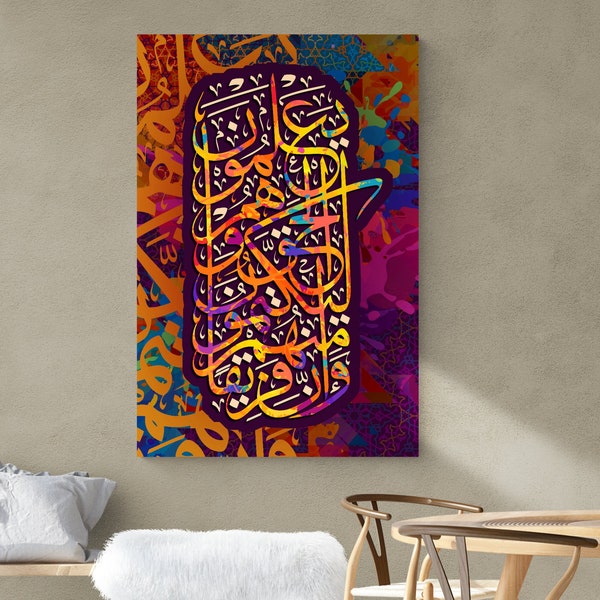
The image size is (600, 600). I want to click on tan wall, so click(x=65, y=83), click(x=512, y=225).